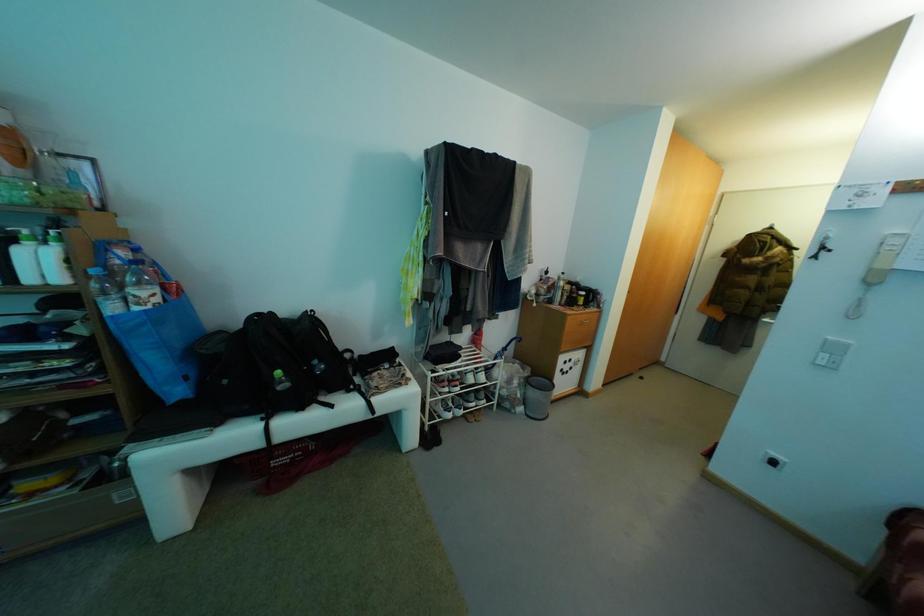
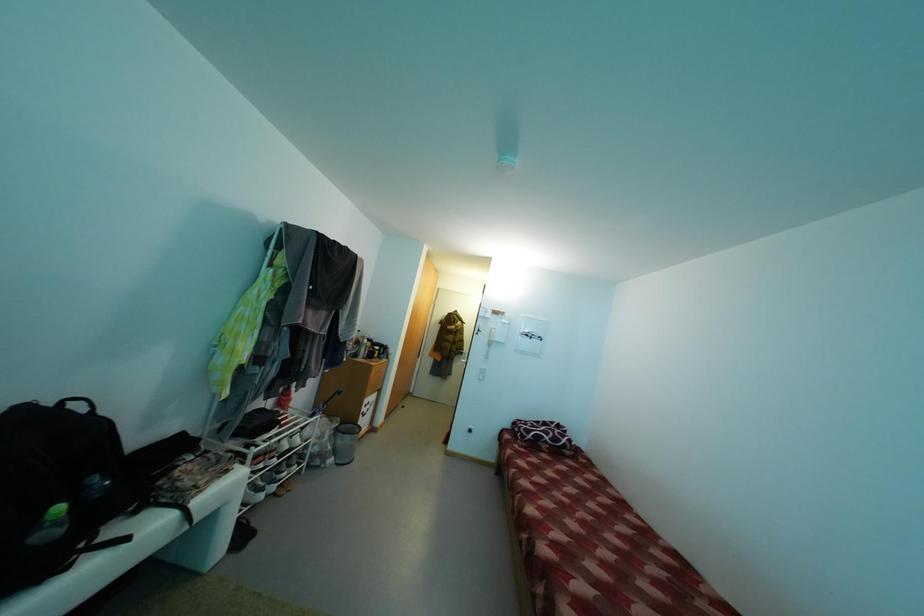
Question: The first image is from the beginning of the video and the second image is from the end. How did the camera likely rotate when shooting the video?

Choices:
 (A) Left
 (B) Right
 (C) Up
 (D) Down

Answer: (B)